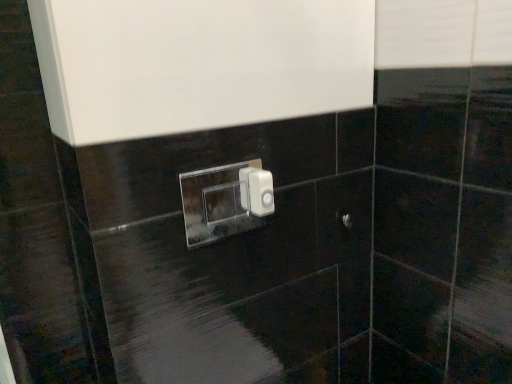
Question: Is white plastic light switch at center, which ranks as the 2th light switch in left-to-right order, at the back of satin nickel door handle at center?

Choices:
 (A) no
 (B) yes

Answer: (A)

Question: Can you confirm if satin nickel door handle at center is wider than white plastic light switch at center, which ranks as the 2th light switch in left-to-right order?

Choices:
 (A) no
 (B) yes

Answer: (A)

Question: Is satin nickel door handle at center positioned far away from white plastic light switch at center, which ranks as the 2th light switch in left-to-right order?

Choices:
 (A) no
 (B) yes

Answer: (A)

Question: Does satin nickel door handle at center touch white plastic light switch at center, which ranks as the 2th light switch in left-to-right order?

Choices:
 (A) no
 (B) yes

Answer: (A)

Question: Is satin nickel door handle at center shorter than white plastic light switch at center, which ranks as the 2th light switch in left-to-right order?

Choices:
 (A) yes
 (B) no

Answer: (A)

Question: Does satin nickel door handle at center appear on the right side of white plastic light switch at center, which ranks as the 2th light switch in left-to-right order?

Choices:
 (A) yes
 (B) no

Answer: (A)

Question: Is transparent acrylic light switch at center, the first light switch in the left-to-right sequence, surrounding satin nickel door handle at center?

Choices:
 (A) yes
 (B) no

Answer: (B)

Question: Is transparent acrylic light switch at center, the first light switch in the left-to-right sequence, to the left of satin nickel door handle at center from the viewer's perspective?

Choices:
 (A) yes
 (B) no

Answer: (A)

Question: Does transparent acrylic light switch at center, which is the 2th light switch from right to left, have a lesser height compared to satin nickel door handle at center?

Choices:
 (A) no
 (B) yes

Answer: (A)

Question: Is transparent acrylic light switch at center, which is the 2th light switch from right to left, outside satin nickel door handle at center?

Choices:
 (A) yes
 (B) no

Answer: (A)

Question: Does transparent acrylic light switch at center, which is the 2th light switch from right to left, lie behind satin nickel door handle at center?

Choices:
 (A) yes
 (B) no

Answer: (B)

Question: Is the surface of transparent acrylic light switch at center, the first light switch in the left-to-right sequence, in direct contact with satin nickel door handle at center?

Choices:
 (A) yes
 (B) no

Answer: (B)

Question: Considering the relative sizes of transparent acrylic light switch at center, which is the 2th light switch from right to left, and white plastic light switch at center, which ranks as the 2th light switch in left-to-right order, in the image provided, is transparent acrylic light switch at center, which is the 2th light switch from right to left, taller than white plastic light switch at center, which ranks as the 2th light switch in left-to-right order,?

Choices:
 (A) no
 (B) yes

Answer: (B)